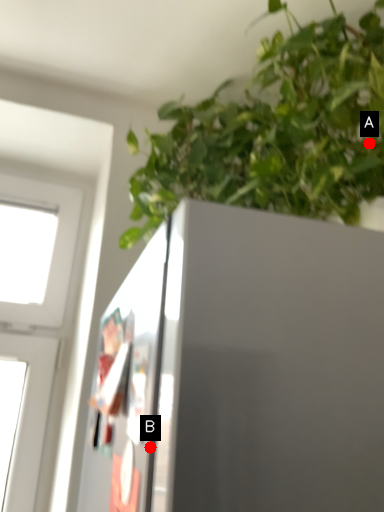
Question: Two points are circled on the image, labeled by A and B beside each circle. Which point is farther from the camera taking this photo?

Choices:
 (A) A is further
 (B) B is further

Answer: (A)